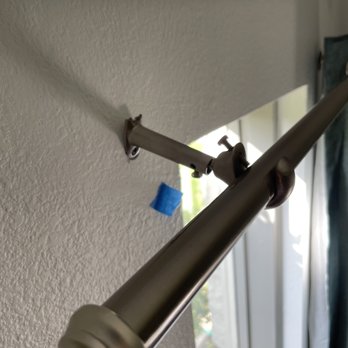
This screenshot has height=348, width=348. I want to click on curtain, so click(336, 58).